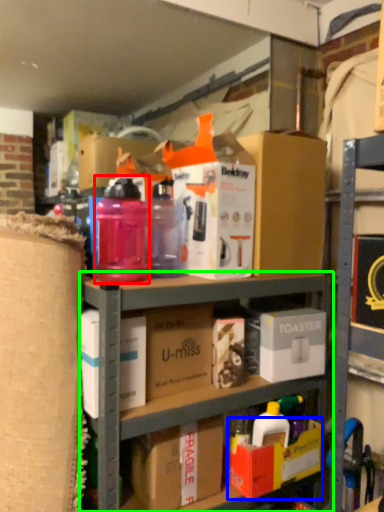
Question: Estimate the real-world distances between objects in this image. Which object is farther from bottle (highlighted by a red box), box (highlighted by a blue box) or shelf (highlighted by a green box)?

Choices:
 (A) box
 (B) shelf

Answer: (A)